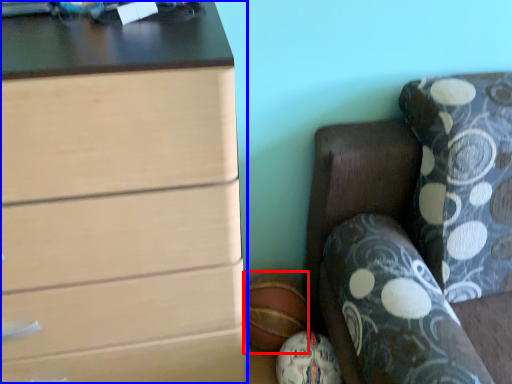
Question: Which object appears farthest to the camera in this image, sports equipment (highlighted by a red box) or chest of drawers (highlighted by a blue box)?

Choices:
 (A) sports equipment
 (B) chest of drawers

Answer: (A)